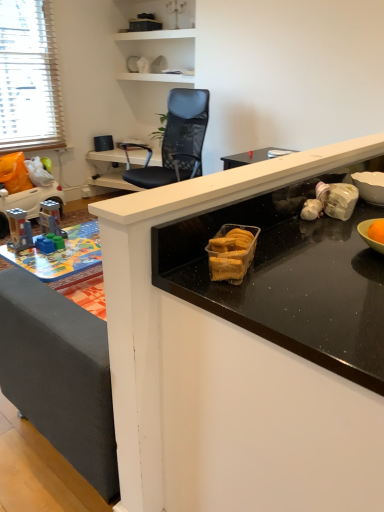
You are a GUI agent. You are given a task and a screenshot of the screen. Output one action in this format:
    pyautogui.click(x=<x>, y=<y>)
    Task: Click on the black mesh chair at upper center
    The width and height of the screenshot is (384, 512).
    Given the screenshot: What is the action you would take?
    pyautogui.click(x=115, y=168)

Identify the location of black glossy countertop at center. (288, 280).

At what (x,y) coordinates should I click in order to perform the action: click on countertop located above the black mesh chair at upper center (from a real-world perspective). Please return your answer as a coordinate pair (x, y). Image resolution: width=384 pixels, height=512 pixels. Looking at the image, I should click on (288, 280).

Is black glossy countertop at center facing towards black mesh chair at upper center?

No, black glossy countertop at center does not turn towards black mesh chair at upper center.

Considering the positions of point (249, 326) and point (144, 155), is point (249, 326) closer or farther from the camera than point (144, 155)?

Point (249, 326).

Is the depth of black glossy countertop at center less than that of black mesh chair at upper center?

Yes, it is in front of black mesh chair at upper center.

Is plastic building blocks at lower left, which is the first toy in bottom-to-top order, taller than black mesh chair at upper center?

Incorrect, the height of plastic building blocks at lower left, which is the first toy in bottom-to-top order, is not larger of that of black mesh chair at upper center.

Is plastic building blocks at lower left, the first toy in the right-to-left sequence, not close to black mesh chair at upper center?

Yes, plastic building blocks at lower left, the first toy in the right-to-left sequence, and black mesh chair at upper center are quite far apart.

From a real-world perspective, who is located lower, plastic building blocks at lower left, which is the first toy in bottom-to-top order, or black mesh chair at upper center?

plastic building blocks at lower left, which is the first toy in bottom-to-top order.

Image resolution: width=384 pixels, height=512 pixels. I want to click on countertop below the plastic building blocks at lower left, positioned as the 2th toy in left-to-right order (from the image's perspective), so click(x=288, y=280).

Considering the sizes of objects plastic building blocks at lower left, which is the second toy from top to bottom, and black glossy countertop at center in the image provided, who is smaller, plastic building blocks at lower left, which is the second toy from top to bottom, or black glossy countertop at center?

With smaller size is plastic building blocks at lower left, which is the second toy from top to bottom.

From the picture: From the image's perspective, is plastic building blocks at lower left, acting as the 2th toy starting from the back, above or below black glossy countertop at center?

From the image's perspective, plastic building blocks at lower left, acting as the 2th toy starting from the back, appears above black glossy countertop at center.

From a real-world perspective, which object stands above the other?

plastic building blocks at lower left, which is the second toy from top to bottom.

In terms of width, does black mesh chair at upper center look wider or thinner when compared to black mesh chair at upper center?

black mesh chair at upper center is wider than black mesh chair at upper center.

Is black mesh chair at upper center behind black mesh chair at upper center?

Yes, black mesh chair at upper center is behind black mesh chair at upper center.

Does point (135, 149) come in front of point (198, 104)?

No, (135, 149) is behind (198, 104).

Is black mesh chair at upper center smaller than black mesh chair at upper center?

Yes.

Considering the sizes of objects black mesh chair at upper center and plastic toy car at left, placed as the first toy when sorted from left to right, in the image provided, who is shorter, black mesh chair at upper center or plastic toy car at left, placed as the first toy when sorted from left to right,?

With less height is plastic toy car at left, placed as the first toy when sorted from left to right.

Is black mesh chair at upper center facing away from plastic toy car at left, the 1th toy viewed from the back?

No, plastic toy car at left, the 1th toy viewed from the back, is not at the back of black mesh chair at upper center.

Is black mesh chair at upper center located outside plastic toy car at left, marked as the first toy in a top-to-bottom arrangement?

Yes.

Does point (176, 147) come farther from viewer compared to point (7, 167)?

Yes, point (176, 147) is farther from viewer.

Which is behind, plastic toy car at left, which is the second toy from bottom to top, or black mesh chair at upper center?

plastic toy car at left, which is the second toy from bottom to top, is more distant.

Are plastic toy car at left, positioned as the second toy in front-to-back order, and black mesh chair at upper center beside each other?

plastic toy car at left, positioned as the second toy in front-to-back order, and black mesh chair at upper center are not in contact.

Based on the photo, between plastic toy car at left, placed as the first toy when sorted from left to right, and black mesh chair at upper center, which one has smaller size?

plastic toy car at left, placed as the first toy when sorted from left to right.

Is black mesh chair at upper center a part of plastic toy car at left, marked as the first toy in a top-to-bottom arrangement?

No, black mesh chair at upper center is not a part of plastic toy car at left, marked as the first toy in a top-to-bottom arrangement.

Does plastic toy car at left, the second toy when ordered from right to left, appear on the left side of black mesh chair at upper center?

Yes.

At what (x,y) coordinates should I click in order to perform the action: click on toy that is the 2nd object to the left of the black mesh chair at upper center, starting at the anchor. Please return your answer as a coordinate pair (x, y). The image size is (384, 512). Looking at the image, I should click on (23, 190).

Based on the photo, from a real-world perspective, who is located lower, plastic toy car at left, positioned as the second toy in front-to-back order, or black mesh chair at upper center?

black mesh chair at upper center is physically lower.

Looking at this image, can you confirm if plastic toy car at left, the second toy when ordered from right to left, is shorter than black mesh chair at upper center?

No, plastic toy car at left, the second toy when ordered from right to left, is not shorter than black mesh chair at upper center.

Locate an element on the screen. The height and width of the screenshot is (512, 384). table behind the black glossy countertop at center is located at coordinates (115, 168).

Identify the location of chair on the right of plastic building blocks at lower left, which is the second toy from top to bottom. (178, 141).

Based on their spatial positions, is plastic toy car at left, the second toy when ordered from right to left, or black glossy countertop at center closer to black mesh chair at upper center?

plastic toy car at left, the second toy when ordered from right to left, is closer to black mesh chair at upper center.

From the image, which object appears to be farther from plastic toy car at left, which is the second toy from bottom to top, black mesh chair at upper center or black mesh chair at upper center?

black mesh chair at upper center is positioned further to the anchor plastic toy car at left, which is the second toy from bottom to top.

Based on the photo, when comparing their distances from black glossy countertop at center, does plastic toy car at left, positioned as the second toy in front-to-back order, or black mesh chair at upper center seem closer?

plastic toy car at left, positioned as the second toy in front-to-back order, is positioned closer to the anchor black glossy countertop at center.

Based on their spatial positions, is plastic toy car at left, which is the second toy from bottom to top, or black mesh chair at upper center closer to black glossy countertop at center?

black mesh chair at upper center is positioned closer to the anchor black glossy countertop at center.

Looking at this image, when comparing their distances from black mesh chair at upper center, does plastic toy car at left, positioned as the second toy in front-to-back order, or black mesh chair at upper center seem closer?

black mesh chair at upper center.

When comparing their distances from black mesh chair at upper center, does black mesh chair at upper center or plastic toy car at left, positioned as the second toy in front-to-back order, seem further?

plastic toy car at left, positioned as the second toy in front-to-back order.

When comparing their distances from black glossy countertop at center, does black mesh chair at upper center or black mesh chair at upper center seem further?

Based on the image, black mesh chair at upper center appears to be further to black glossy countertop at center.

When comparing their distances from black mesh chair at upper center, does black glossy countertop at center or plastic toy car at left, the second toy when ordered from right to left, seem further?

black glossy countertop at center is further to black mesh chair at upper center.

The image size is (384, 512). Identify the location of chair between black glossy countertop at center and black mesh chair at upper center in the front-back direction. (178, 141).

Locate an element on the screen. This screenshot has width=384, height=512. chair located between black glossy countertop at center and plastic toy car at left, the 1th toy viewed from the back, in the depth direction is located at coordinates click(x=178, y=141).

Where is `toy between plastic building blocks at lower left, positioned as the 2th toy in left-to-right order, and black mesh chair at upper center, along the z-axis`? The height and width of the screenshot is (512, 384). toy between plastic building blocks at lower left, positioned as the 2th toy in left-to-right order, and black mesh chair at upper center, along the z-axis is located at coordinates (23, 190).

Where is `toy positioned between black glossy countertop at center and black mesh chair at upper center from near to far`? toy positioned between black glossy countertop at center and black mesh chair at upper center from near to far is located at coordinates (51, 219).